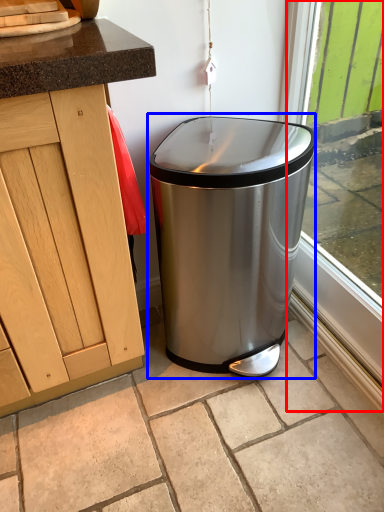
Question: Which object appears closest to the camera in this image, window frame (highlighted by a red box) or waste container (highlighted by a blue box)?

Choices:
 (A) window frame
 (B) waste container

Answer: (A)